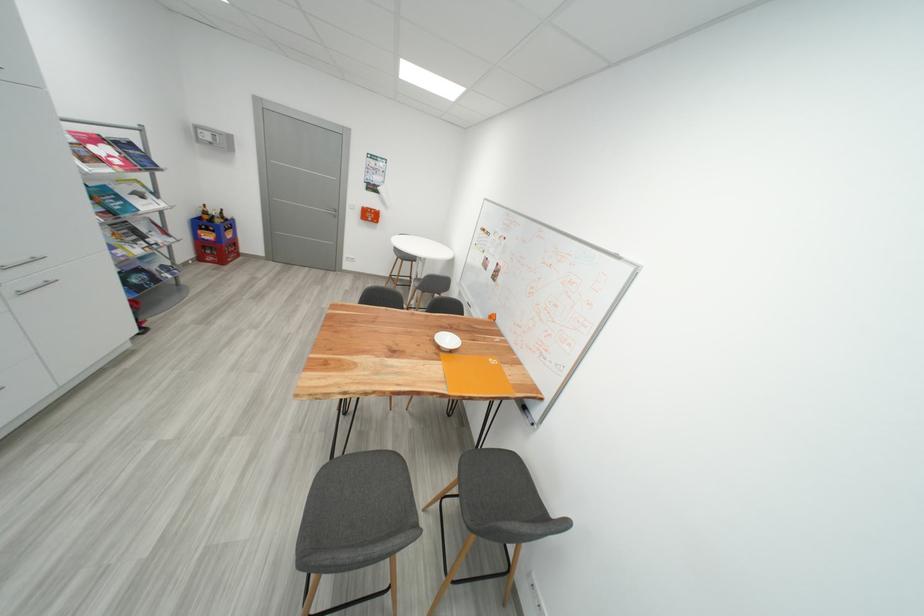
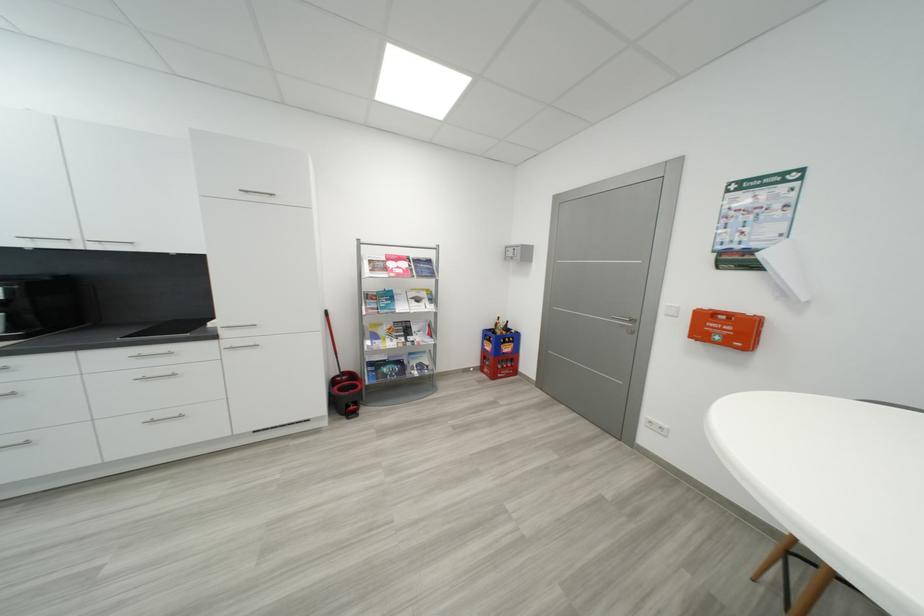
Locate, in the second image, the point that corresponds to (x=378, y=217) in the first image.

(733, 333)